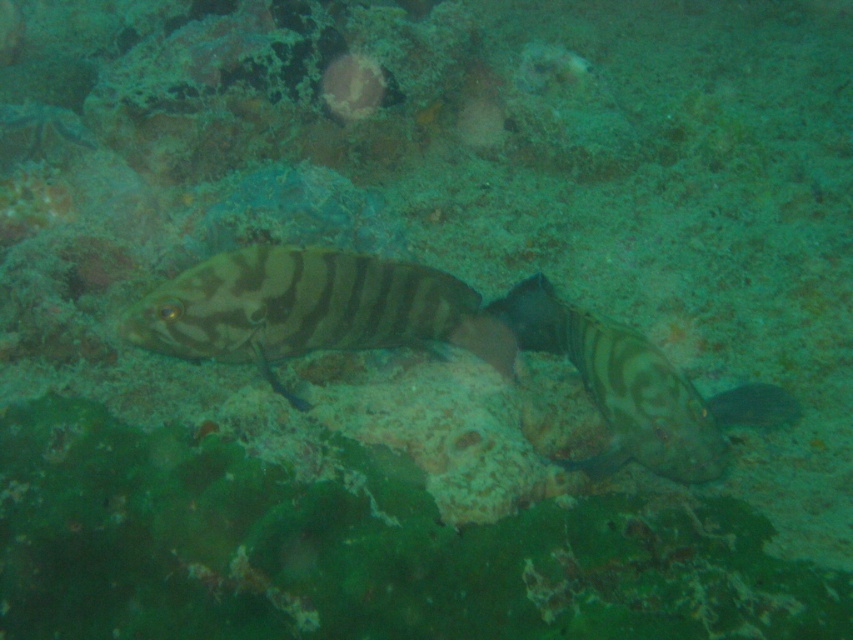
You are a marine biologist studying fish locations in an underwater environment. You observe the striped matte fish at center in the image. What are the coordinates of its position?

The coordinates of the striped matte fish at center are at point (311, 308).